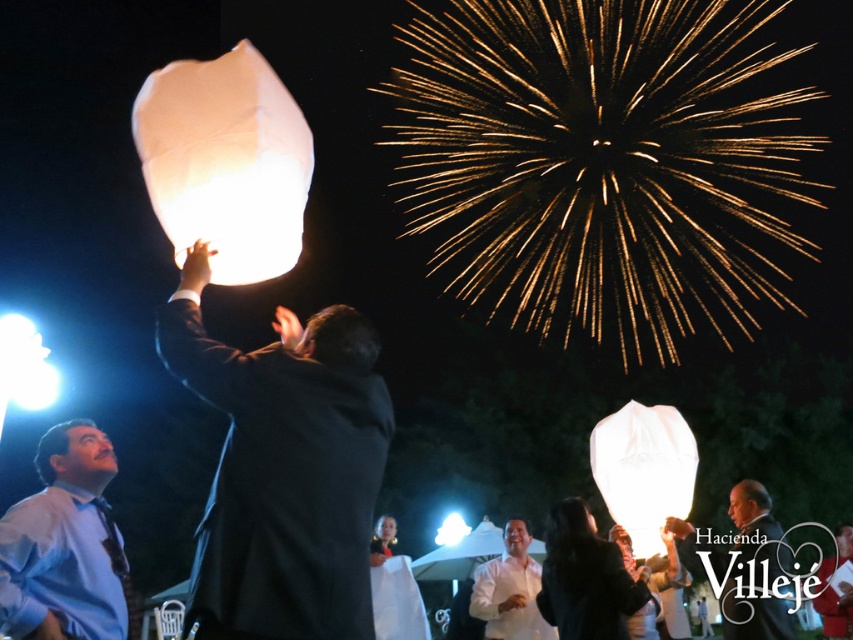
Which of these two, white translucent paper lantern at upper left or white matte shirt at center, stands shorter?

white matte shirt at center is shorter.

Is white translucent paper lantern at upper left to the left of white matte shirt at center from the viewer's perspective?

Indeed, white translucent paper lantern at upper left is positioned on the left side of white matte shirt at center.

Measure the distance between white translucent paper lantern at upper left and camera.

A distance of 11.83 feet exists between white translucent paper lantern at upper left and camera.

Find the location of a particular element. This screenshot has width=853, height=640. white translucent paper lantern at upper left is located at coordinates (225, 163).

Does matte black suit at center have a smaller size compared to white paper lantern at upper center?

No.

Who is shorter, matte black suit at center or white paper lantern at upper center?

white paper lantern at upper center is shorter.

Where is `matte black suit at center`? The width and height of the screenshot is (853, 640). matte black suit at center is located at coordinates (283, 470).

In order to click on matte black suit at center in this screenshot , I will do `click(283, 470)`.

Who is higher up, matte black suit at center or smooth black suit at center?

matte black suit at center is above.

Who is shorter, matte black suit at center or smooth black suit at center?

smooth black suit at center is shorter.

Does point (280, 508) come in front of point (740, 502)?

That is True.

You are a GUI agent. You are given a task and a screenshot of the screen. Output one action in this format:
    pyautogui.click(x=<x>, y=<y>)
    Task: Click on the matte black suit at center
    
    Given the screenshot: What is the action you would take?
    pyautogui.click(x=283, y=470)